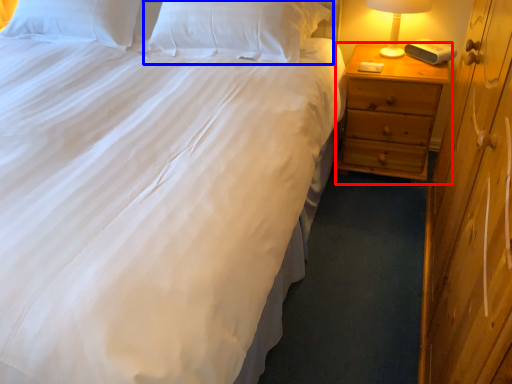
Question: Which point is closer to the camera, nightstand (highlighted by a red box) or pillow (highlighted by a blue box)?

Choices:
 (A) nightstand
 (B) pillow

Answer: (B)